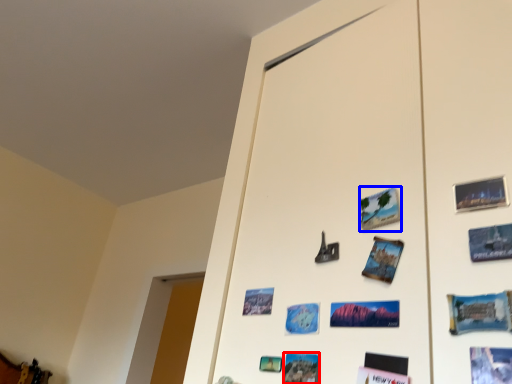
Question: Among these objects, which one is nearest to the camera, postcard (highlighted by a red box) or postcard (highlighted by a blue box)?

Choices:
 (A) postcard
 (B) postcard

Answer: (A)